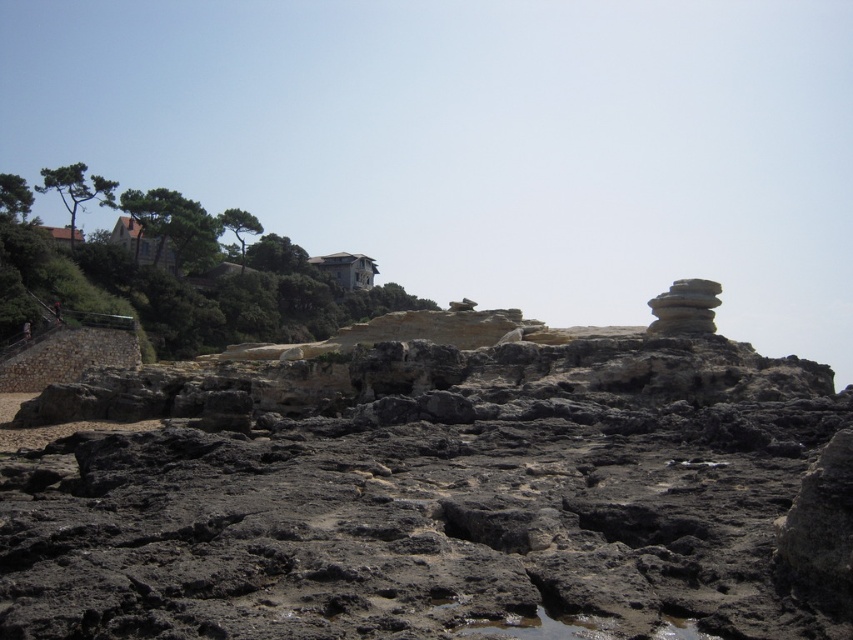
Can you confirm if rough textured rock at center is positioned to the right of smooth gray rock at upper right?

In fact, rough textured rock at center is to the left of smooth gray rock at upper right.

Between rough textured rock at center and smooth gray rock at upper right, which one is positioned lower?

rough textured rock at center is below.

You are a GUI agent. You are given a task and a screenshot of the screen. Output one action in this format:
    pyautogui.click(x=<x>, y=<y>)
    Task: Click on the rough textured rock at center
    This screenshot has height=640, width=853.
    Given the screenshot: What is the action you would take?
    pyautogui.click(x=434, y=490)